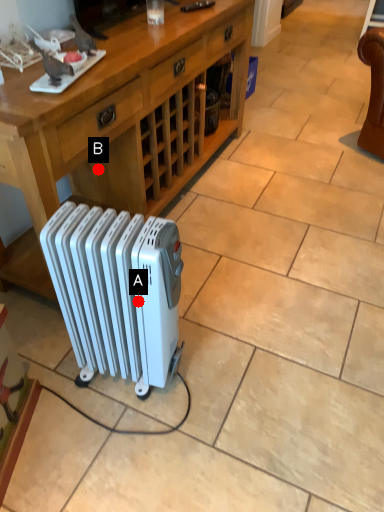
Question: Two points are circled on the image, labeled by A and B beside each circle. Which point is closer to the camera?

Choices:
 (A) A is closer
 (B) B is closer

Answer: (A)